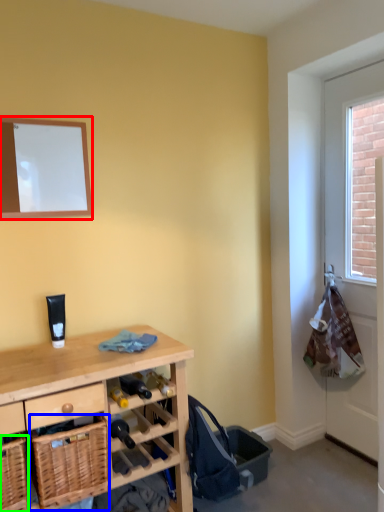
Question: Considering the real-world distances, which object is closest to mirror (highlighted by a red box)? basket (highlighted by a blue box) or basket (highlighted by a green box).

Choices:
 (A) basket
 (B) basket

Answer: (A)